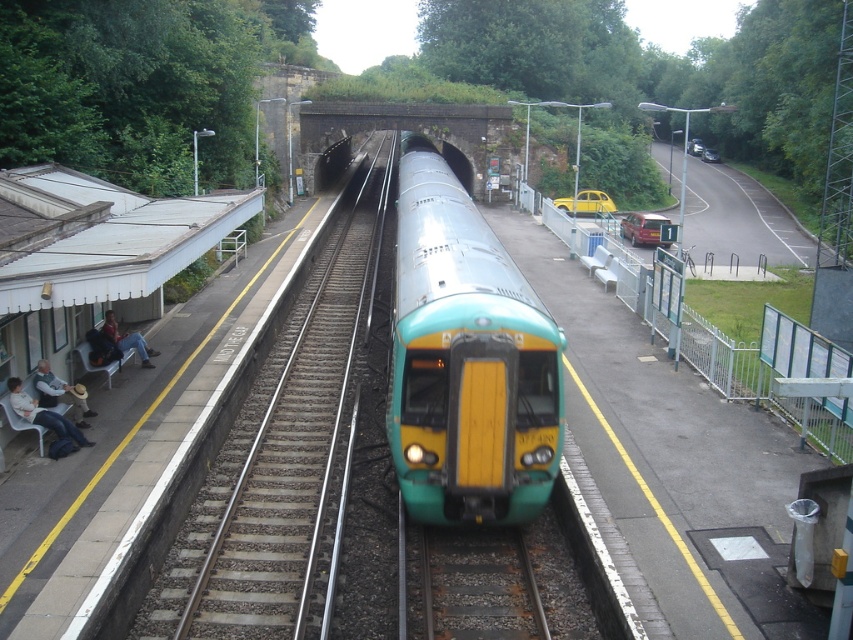
Question: Is teal glossy passenger train at center behind denim jacket at left?

Choices:
 (A) yes
 (B) no

Answer: (B)

Question: Which of the following is the farthest from the observer?

Choices:
 (A) teal glossy passenger train at center
 (B) rusty metal train track at center
 (C) light brown straw hat at left

Answer: (C)

Question: Is rusty metal train track at center further to camera compared to light brown straw hat at left?

Choices:
 (A) no
 (B) yes

Answer: (A)

Question: Which point is farther to the camera?

Choices:
 (A) rusty metal train track at center
 (B) light brown straw hat at left
 (C) teal glossy passenger train at center

Answer: (B)

Question: Can you confirm if rusty metal train track at center is wider than light brown straw hat at left?

Choices:
 (A) yes
 (B) no

Answer: (A)

Question: Which point is closer to the camera?

Choices:
 (A) light brown straw hat at left
 (B) white plastic chair at lower left

Answer: (B)